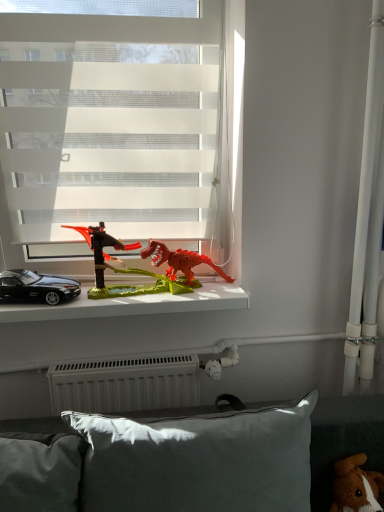
Question: From a real-world perspective, relative to gray fabric pillow at lower center, is rubberized red dinosaur at center, positioned as the 1th toy in top-to-bottom order, vertically above or below?

Choices:
 (A) below
 (B) above

Answer: (B)

Question: Looking at their shapes, would you say rubberized red dinosaur at center, positioned as the 1th toy in top-to-bottom order, is wider or thinner than gray fabric pillow at lower center?

Choices:
 (A) wide
 (B) thin

Answer: (B)

Question: Which object is positioned farthest from the white translucent blinds at upper center?

Choices:
 (A) black plastic car at left
 (B) brown plush toy at lower right, placed as the 2th toy when sorted from left to right
 (C) rubberized red dinosaur at center, positioned as the 1th toy in top-to-bottom order
 (D) gray fabric pillow at lower center
 (E) black matte car at left

Answer: (B)

Question: Which object is positioned farthest from the gray fabric pillow at lower center?

Choices:
 (A) white translucent blinds at upper center
 (B) rubberized red dinosaur at center, placed as the first toy when sorted from back to front
 (C) black matte car at left
 (D) black plastic car at left
 (E) brown plush toy at lower right, placed as the 2th toy when sorted from left to right

Answer: (A)